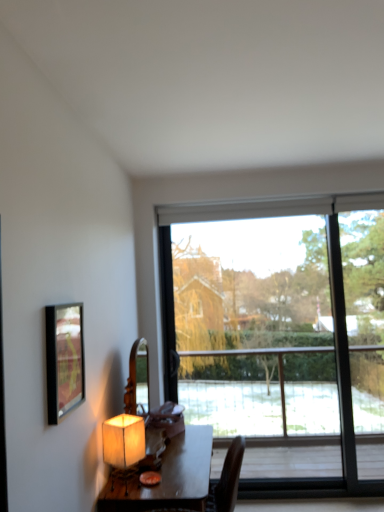
Question: Does transparent glass window at center turn towards wooden table at center?

Choices:
 (A) yes
 (B) no

Answer: (A)

Question: Is transparent glass window at center further to the viewer compared to wooden table at center?

Choices:
 (A) no
 (B) yes

Answer: (B)

Question: Is wooden table at center at the back of transparent glass window at center?

Choices:
 (A) no
 (B) yes

Answer: (A)

Question: Is there a large distance between transparent glass window at center and wooden table at center?

Choices:
 (A) no
 (B) yes

Answer: (B)

Question: Does transparent glass window at center come in front of wooden table at center?

Choices:
 (A) yes
 (B) no

Answer: (B)

Question: Considering the relative sizes of transparent glass window at center and wooden table at center in the image provided, is transparent glass window at center bigger than wooden table at center?

Choices:
 (A) yes
 (B) no

Answer: (B)

Question: From the image's perspective, is wooden table at center above matte beige lampshade at lower left?

Choices:
 (A) no
 (B) yes

Answer: (A)

Question: From a real-world perspective, is wooden table at center on top of matte beige lampshade at lower left?

Choices:
 (A) yes
 (B) no

Answer: (B)

Question: Is wooden table at center outside of matte beige lampshade at lower left?

Choices:
 (A) yes
 (B) no

Answer: (A)

Question: Can you confirm if wooden table at center is bigger than matte beige lampshade at lower left?

Choices:
 (A) yes
 (B) no

Answer: (A)

Question: Can you confirm if wooden table at center is positioned to the left of matte beige lampshade at lower left?

Choices:
 (A) no
 (B) yes

Answer: (A)

Question: Is wooden table at center thinner than matte beige lampshade at lower left?

Choices:
 (A) no
 (B) yes

Answer: (A)

Question: Does wooden table at center have a greater width compared to transparent glass window at center?

Choices:
 (A) no
 (B) yes

Answer: (B)